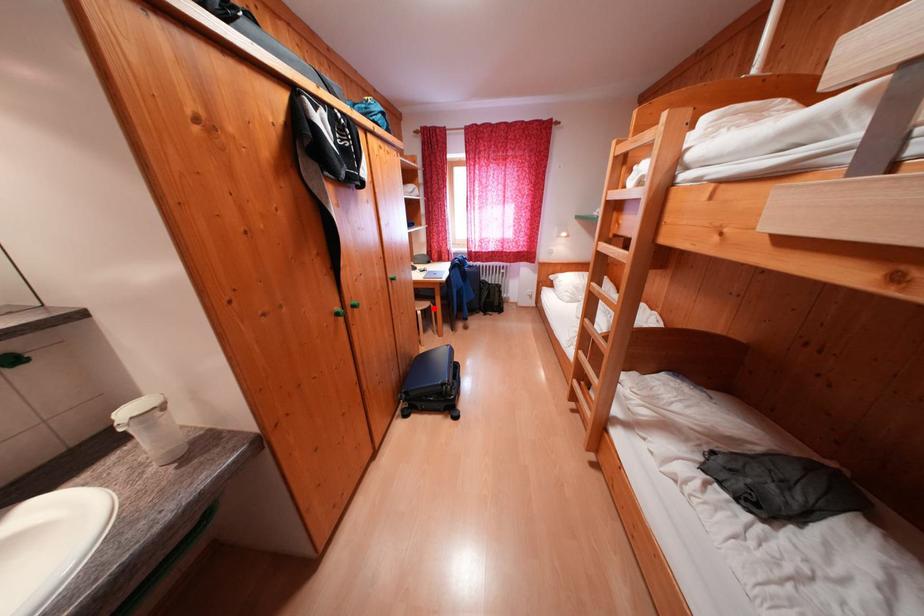
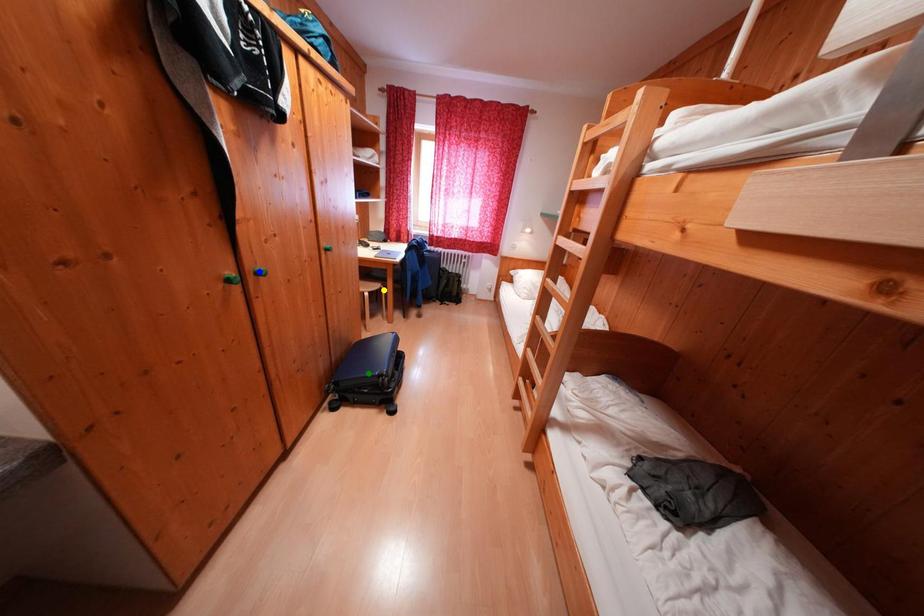
Question: I am providing you with two images of the same scene from different viewpoints. A red point is marked on the first image. You are given multiple points on the second image. Which point in image 2 represents the same 3d spot as the red point in image 1?

Choices:
 (A) green point
 (B) yellow point
 (C) blue point

Answer: (B)